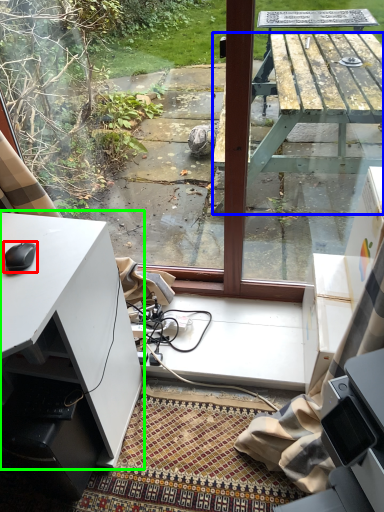
Question: Considering the real-world distances, which object is closest to mouse (highlighted by a red box)? table (highlighted by a blue box) or desk (highlighted by a green box).

Choices:
 (A) table
 (B) desk

Answer: (B)